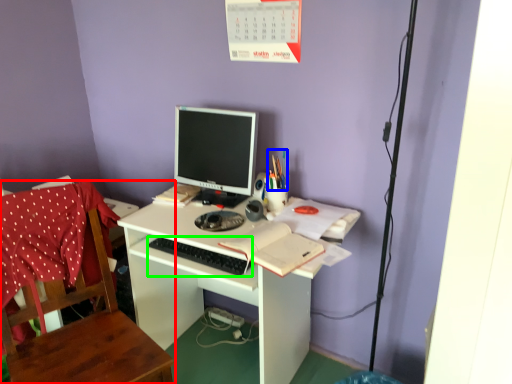
Question: Considering the real-world distances, which object is closest to chair (highlighted by a red box)? stationery (highlighted by a blue box) or computer keyboard (highlighted by a green box).

Choices:
 (A) stationery
 (B) computer keyboard

Answer: (B)